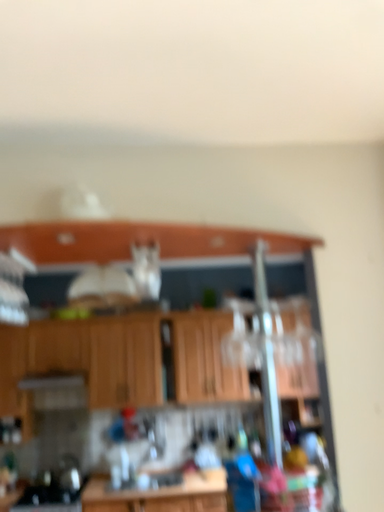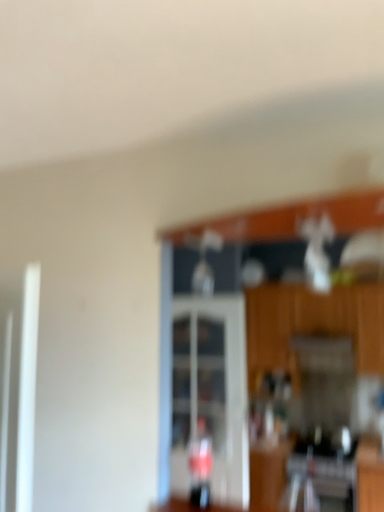
Question: Which way did the camera rotate in the video?

Choices:
 (A) rotated right
 (B) rotated left

Answer: (B)